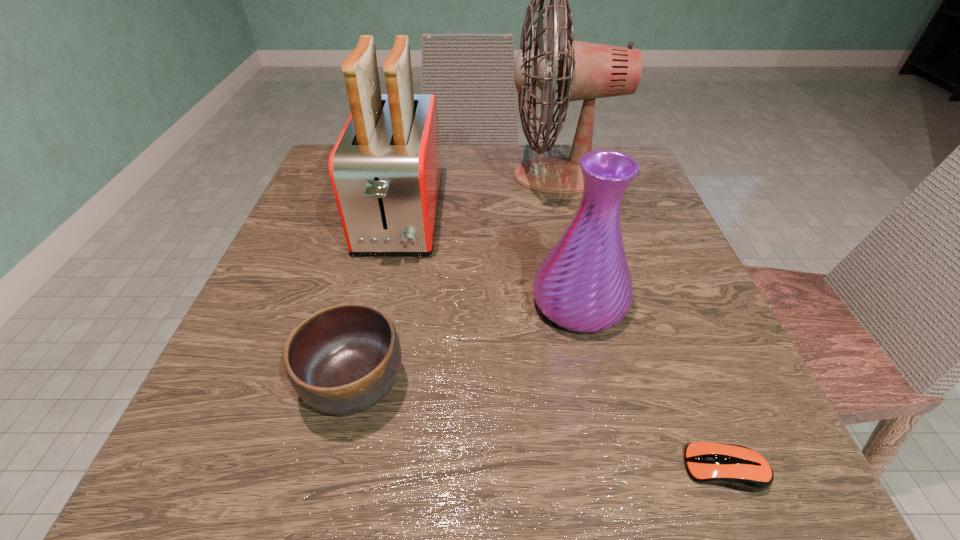
Identify the location of vacant space situated 0.060m in front of the fan to direct airflow. (482, 176).

Image resolution: width=960 pixels, height=540 pixels. What are the coordinates of `vacant space situated on the front-facing side of the toaster` in the screenshot? It's located at (383, 297).

Locate an element on the screen. The height and width of the screenshot is (540, 960). vacant space positioned on the right of the third farthest object is located at coordinates (682, 303).

Where is `vacant space located 0.380m on the back of the bowl`? This screenshot has width=960, height=540. vacant space located 0.380m on the back of the bowl is located at coordinates (398, 199).

I want to click on free space located on the back of the shortest object, so click(x=635, y=239).

Image resolution: width=960 pixels, height=540 pixels. What are the coordinates of `fan that is at the far edge` in the screenshot? It's located at (585, 71).

Image resolution: width=960 pixels, height=540 pixels. I want to click on toaster located in the far edge section of the desktop, so click(x=385, y=169).

The height and width of the screenshot is (540, 960). I want to click on bowl located at the near edge, so click(343, 359).

The image size is (960, 540). In order to click on computer mouse positioned at the near edge in this screenshot , I will do `click(737, 467)`.

Where is `toaster at the left edge`? toaster at the left edge is located at coordinates (385, 169).